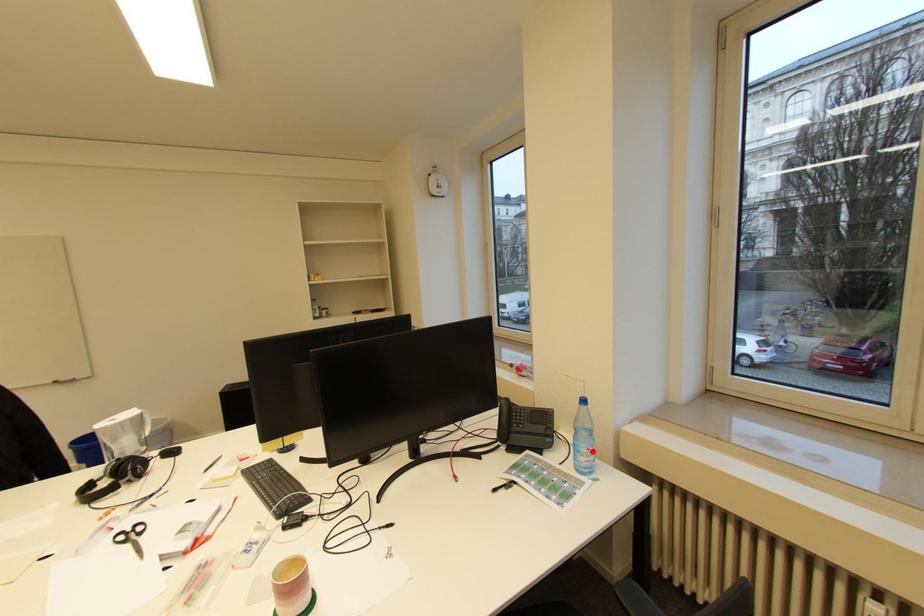
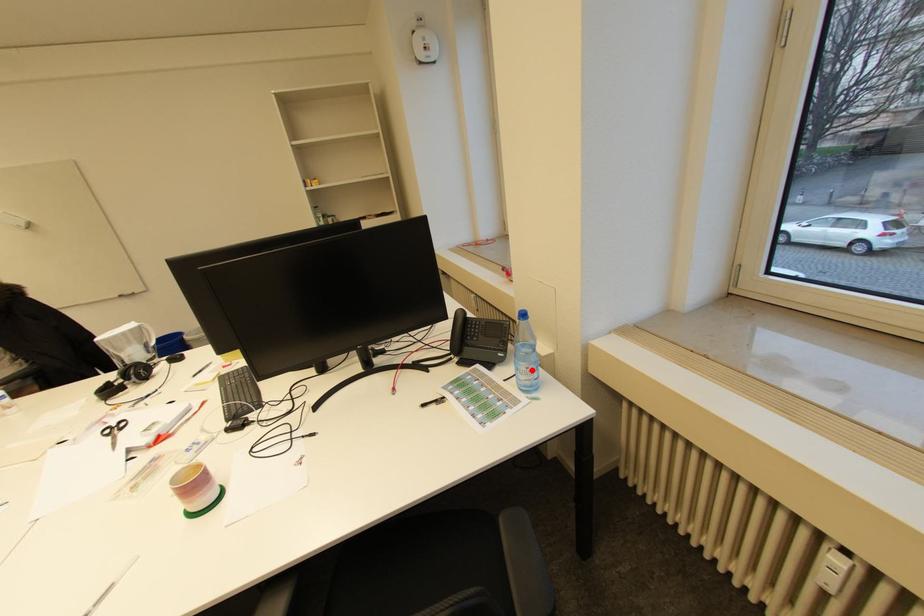
I am providing you with two images of the same scene from different viewpoints. A red point is marked on the first image and another point is marked on the second image. Do the highlighted points in image1 and image2 indicate the same real-world spot?

Yes